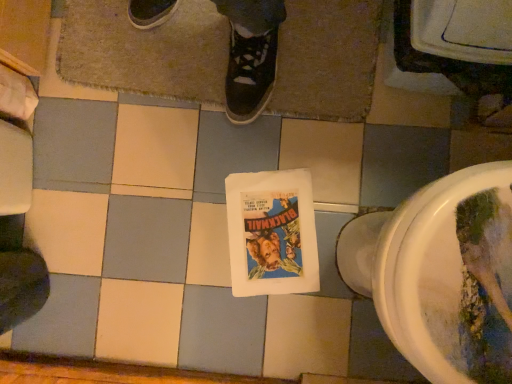
Identify the location of free space underneath matte paper comic book at center (from a real-world perspective). Image resolution: width=512 pixels, height=384 pixels. (253, 247).